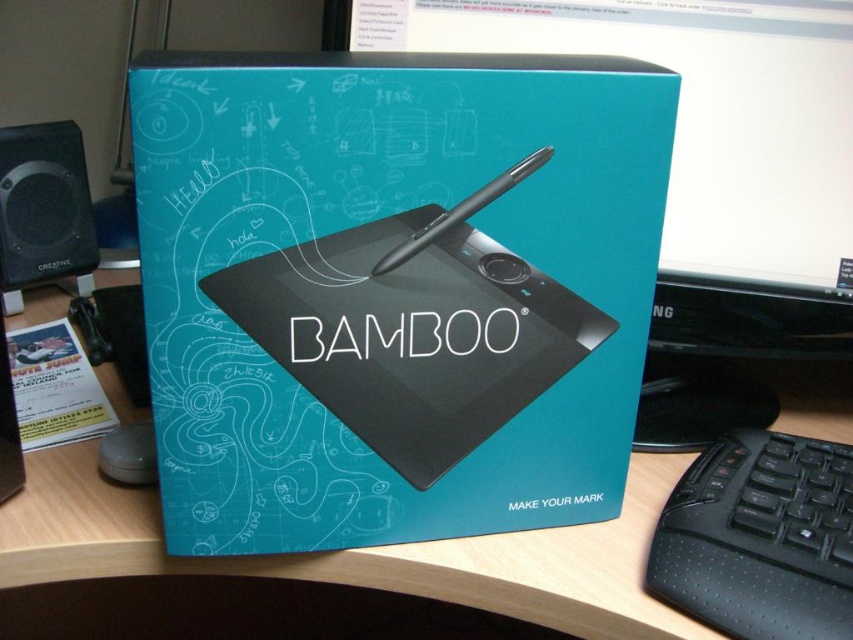
Question: Which object is positioned closest to the white paper flyer at lower left?

Choices:
 (A) black plastic speaker at left
 (B) black glossy monitor at upper center
 (C) black plastic mouse at lower left

Answer: (C)

Question: Which object appears closest to the camera in this image?

Choices:
 (A) black glossy monitor at upper center
 (B) black plastic mouse at lower left

Answer: (B)

Question: Is black glossy monitor at upper center closer to camera compared to black plastic speaker at left?

Choices:
 (A) no
 (B) yes

Answer: (B)

Question: Estimate the real-world distances between objects in this image. Which object is farther from the white paper flyer at lower left?

Choices:
 (A) black glossy monitor at upper center
 (B) black plastic speaker at left
 (C) black plastic mouse at lower left

Answer: (A)

Question: In this image, where is black glossy monitor at upper center located relative to wooden at center?

Choices:
 (A) below
 (B) above

Answer: (B)

Question: Can you confirm if black plastic speaker at left is positioned to the right of white paper flyer at lower left?

Choices:
 (A) no
 (B) yes

Answer: (A)